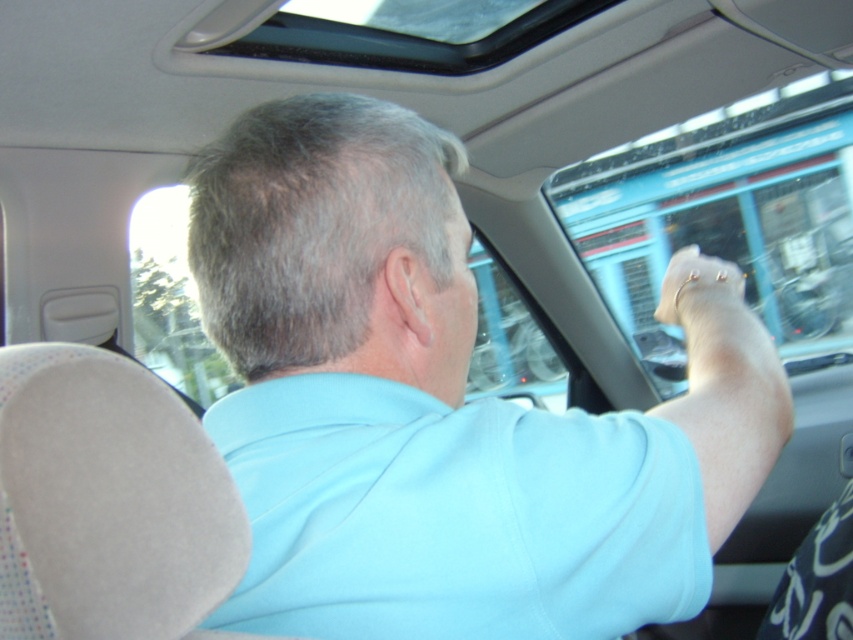
You are sitting in the passenger seat of a car. You notice the light blue shirt at center and the transparent glass window at upper left. Which object is taller?

The light blue shirt at center is taller than the transparent glass window at upper left.

You are a passenger in a car and want to point out a specific location on the driver. Where is the point at coordinates point (434,410) located?

The point at coordinates point (434,410) is located on the light blue shirt at center.

You are sitting in the passenger seat of the car. You notice a transparent glass window at upper center and a gold metallic bracelet at upper center. Which object is closer to you?

The transparent glass window at upper center is further to the viewer than gold metallic bracelet at upper center, so the gold metallic bracelet at upper center is closer to you.